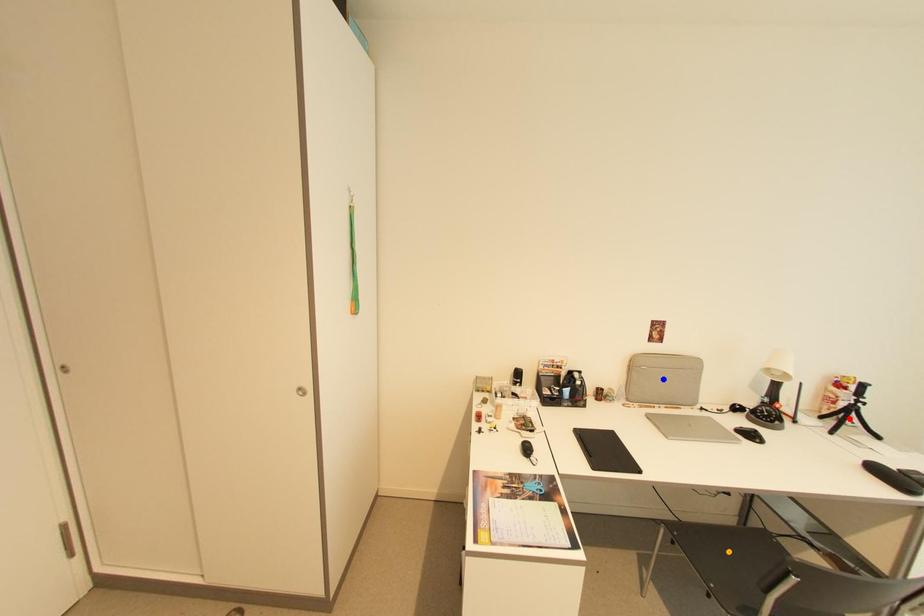
Order these from nearest to farthest:
orange point, red point, blue point

orange point < red point < blue point